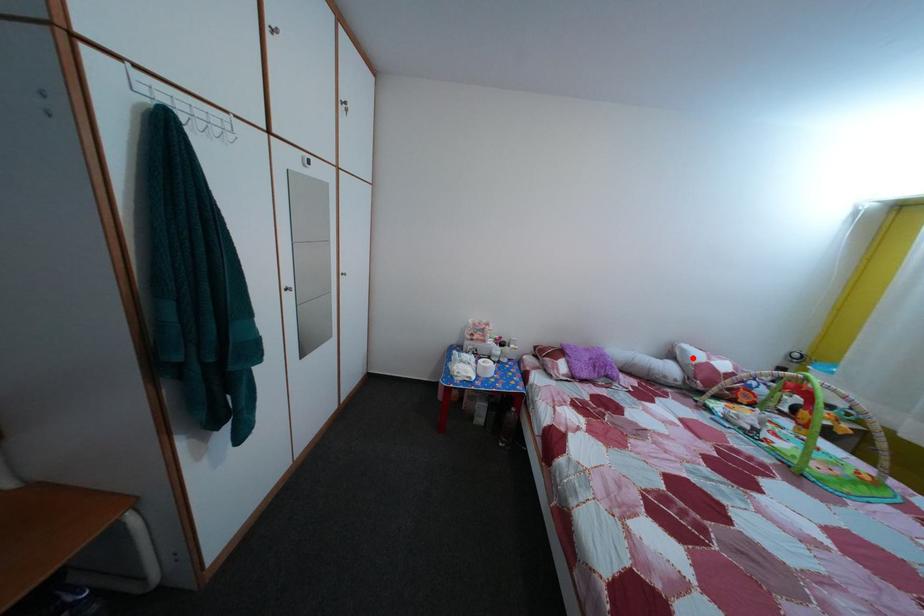
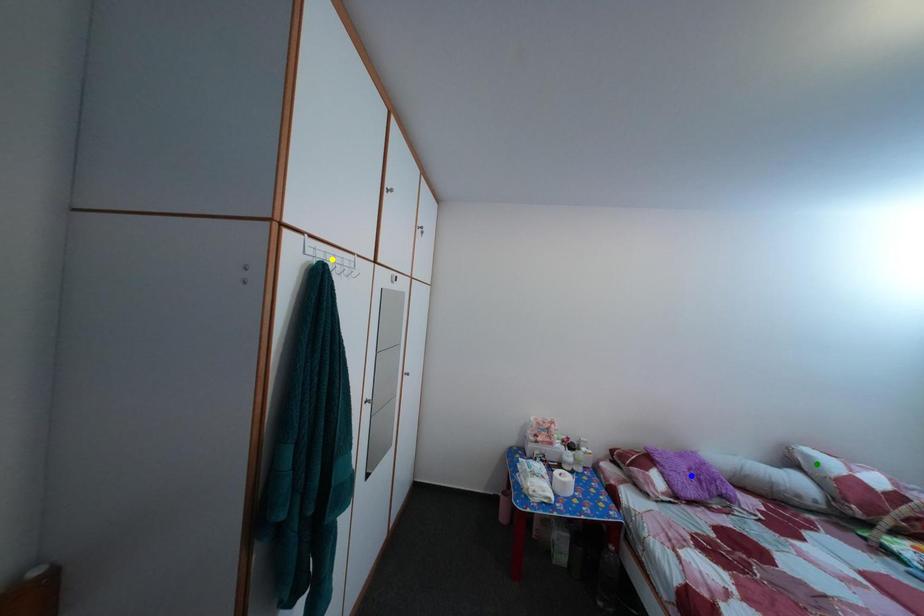
Question: I am providing you with two images of the same scene from different viewpoints. A red point is marked on the first image. You are given multiple points on the second image. Which point in image 2 represents the same 3d spot as the red point in image 1?

Choices:
 (A) blue point
 (B) green point
 (C) yellow point

Answer: (B)